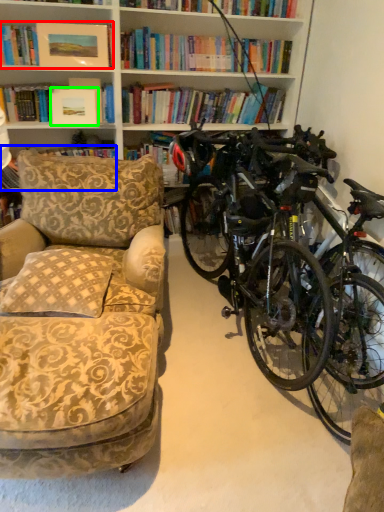
Question: Which is farther away from book (highlighted by a red box)? book (highlighted by a blue box) or picture frame (highlighted by a green box)?

Choices:
 (A) book
 (B) picture frame

Answer: (A)